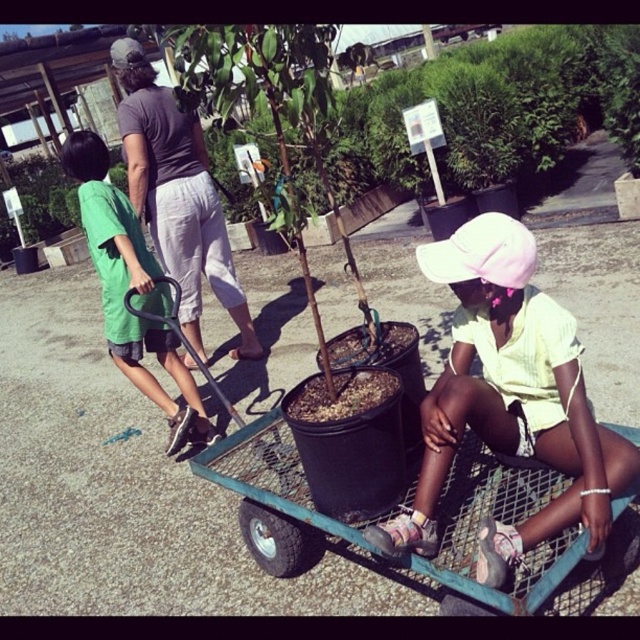
Is point (512, 332) positioned in front of point (540, 589)?

That is False.

Consider the image. Between white matte hat at center and green metal cart at center, which one has more height?

Standing taller between the two is green metal cart at center.

Between point (433, 464) and point (294, 449), which one is positioned behind?

Positioned behind is point (294, 449).

At what (x,y) coordinates should I click in order to perform the action: click on white matte hat at center. Please return your answer as a coordinate pair (x, y). Image resolution: width=640 pixels, height=640 pixels. Looking at the image, I should click on (508, 397).

Does white matte hat at center appear on the left side of green cotton shirt at left?

No, white matte hat at center is not to the left of green cotton shirt at left.

Is white matte hat at center further to camera compared to green cotton shirt at left?

No, it is in front of green cotton shirt at left.

You are a GUI agent. You are given a task and a screenshot of the screen. Output one action in this format:
    pyautogui.click(x=<x>, y=<y>)
    Task: Click on the white matte hat at center
    The image size is (640, 640).
    Given the screenshot: What is the action you would take?
    pyautogui.click(x=508, y=397)

Describe the element at coordinates (280, 490) in the screenshot. The width and height of the screenshot is (640, 640). I see `green metal cart at center` at that location.

Does green metal cart at center come behind gray cotton shirt at upper left?

No, it is not.

Locate an element on the screen. This screenshot has width=640, height=640. green metal cart at center is located at coordinates (280, 490).

Find the location of `green metal cart at center`. green metal cart at center is located at coordinates (280, 490).